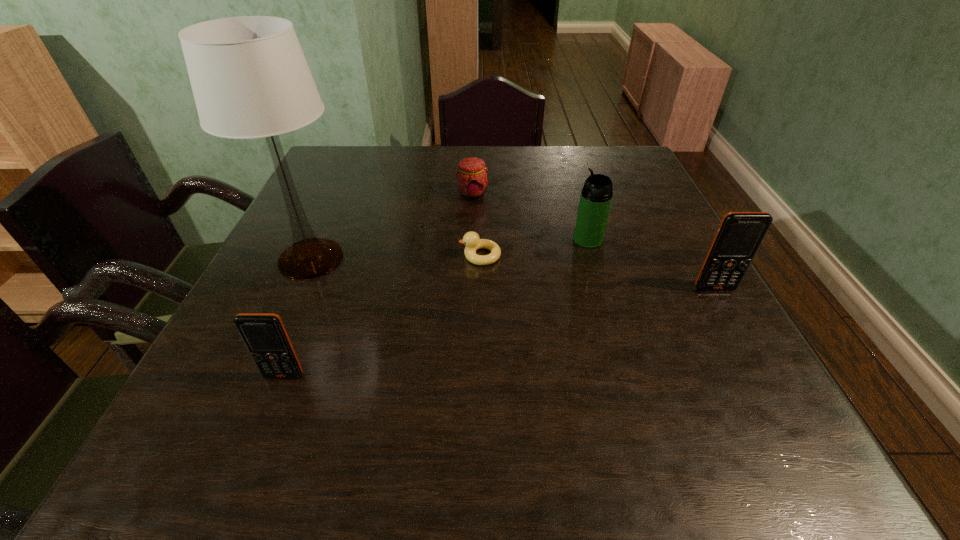
Locate an element on the screen. table lamp present at the left edge is located at coordinates (250, 79).

Find the location of a particular element. The width and height of the screenshot is (960, 540). object at the right edge is located at coordinates (739, 235).

Locate an element on the screen. object present at the near left corner is located at coordinates (264, 334).

Image resolution: width=960 pixels, height=540 pixels. What are the coordinates of `vacant region at the far edge of the desktop` in the screenshot? It's located at (393, 179).

In the image, there is a desktop. At what (x,y) coordinates should I click in order to perform the action: click on free space at the near edge. Please return your answer as a coordinate pair (x, y). The height and width of the screenshot is (540, 960). Looking at the image, I should click on (499, 381).

Identify the location of vacant area at the right edge of the desktop. This screenshot has height=540, width=960. (660, 200).

In order to click on free region at the far left corner in this screenshot , I will do `click(326, 156)`.

You are a GUI agent. You are given a task and a screenshot of the screen. Output one action in this format:
    pyautogui.click(x=<x>, y=<y>)
    Task: Click on the vacant space at the near left corner of the desktop
    The image size is (960, 540).
    Given the screenshot: What is the action you would take?
    pyautogui.click(x=274, y=389)

Locate an element on the screen. empty space that is in between the left cellular telephone and the rightmost object is located at coordinates (499, 332).

Image resolution: width=960 pixels, height=540 pixels. I want to click on vacant space that is in between the thermos bottle and the jam, so click(x=530, y=217).